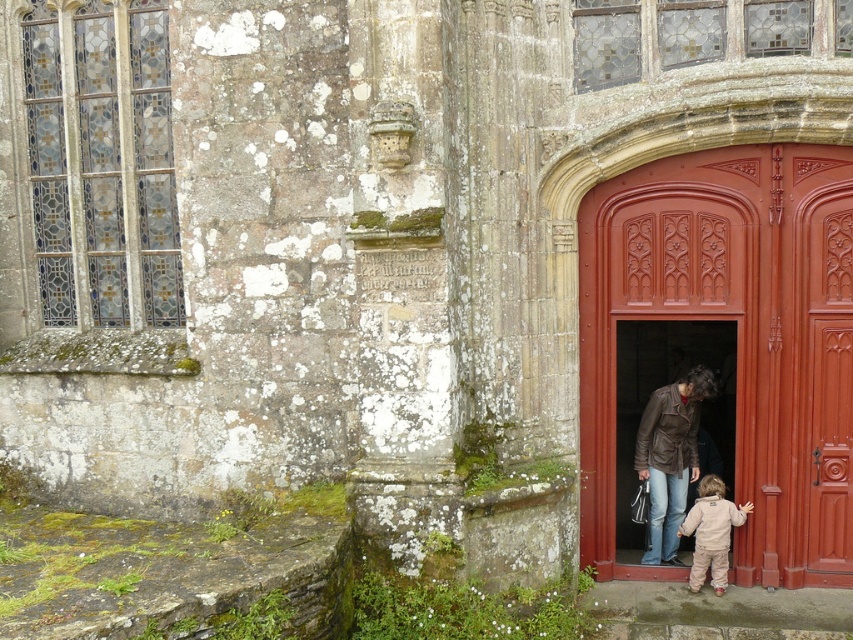
Question: In this image, where is smooth polished wood door at center right located relative to light brown fleece jacket at lower right?

Choices:
 (A) right
 (B) left

Answer: (A)

Question: Can you confirm if smooth polished wood door at center right is bigger than light brown fleece jacket at lower right?

Choices:
 (A) yes
 (B) no

Answer: (A)

Question: Does smooth polished wood door at center right appear on the right side of brown leather jacket at center?

Choices:
 (A) yes
 (B) no

Answer: (A)

Question: Among these objects, which one is nearest to the camera?

Choices:
 (A) brown leather jacket at center
 (B) smooth polished wood door at center right

Answer: (B)

Question: Among these points, which one is farthest from the camera?

Choices:
 (A) (708, 552)
 (B) (645, 442)

Answer: (B)

Question: Which point is closer to the camera taking this photo?

Choices:
 (A) (647, 454)
 (B) (704, 477)
 (C) (625, 176)

Answer: (C)